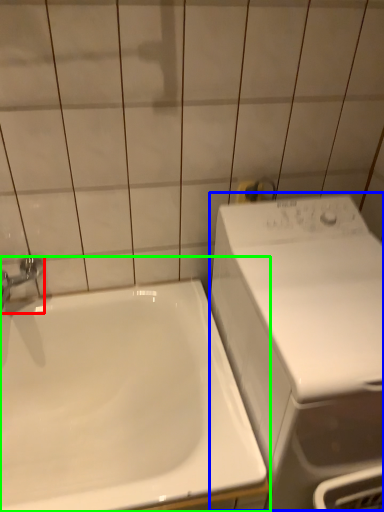
Question: Based on their relative distances, which object is farther from tap (highlighted by a red box)? Choose from washing machine (highlighted by a blue box) and sink (highlighted by a green box).

Choices:
 (A) washing machine
 (B) sink

Answer: (A)